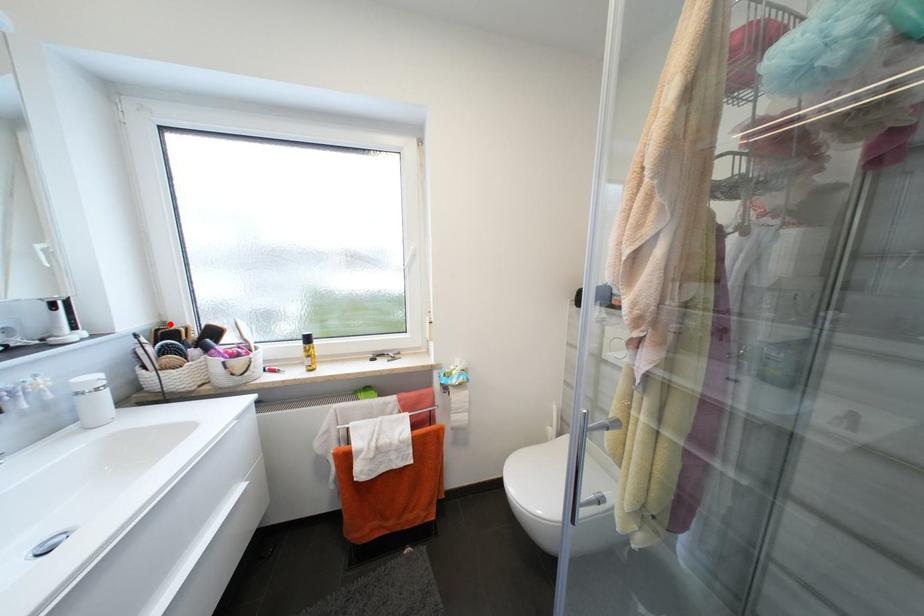
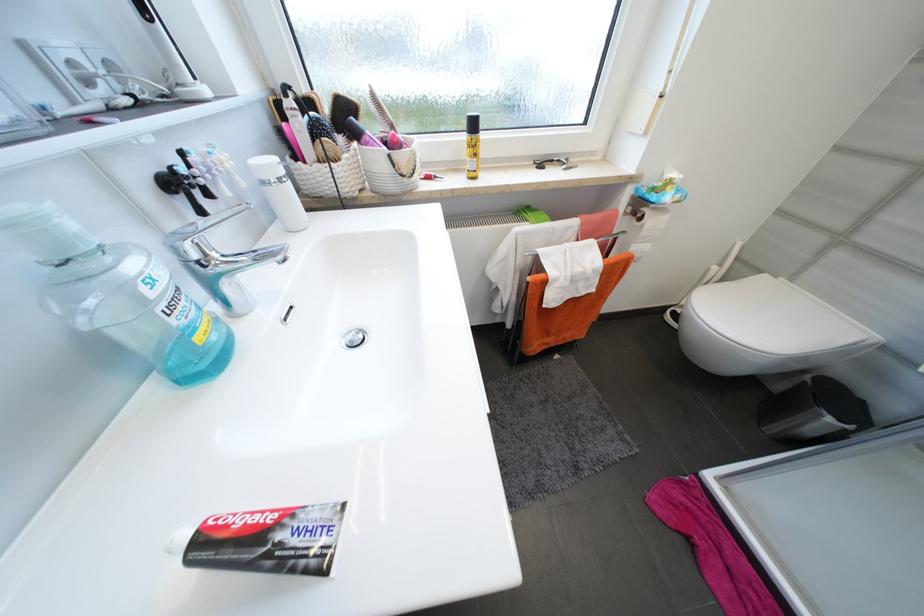
The point at the highlighted location is marked in the first image. Where is the corresponding point in the second image?

(280, 92)